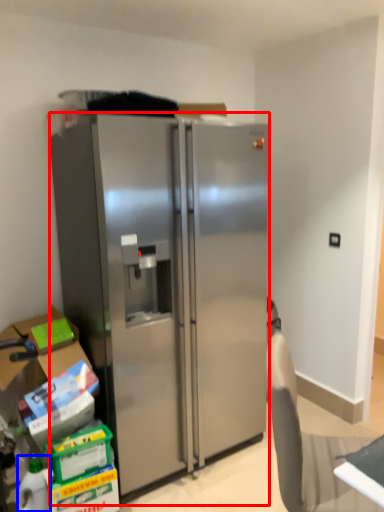
Question: Which of the following is the farthest to the observer, refrigerator (highlighted by a red box) or bottle (highlighted by a blue box)?

Choices:
 (A) refrigerator
 (B) bottle

Answer: (B)